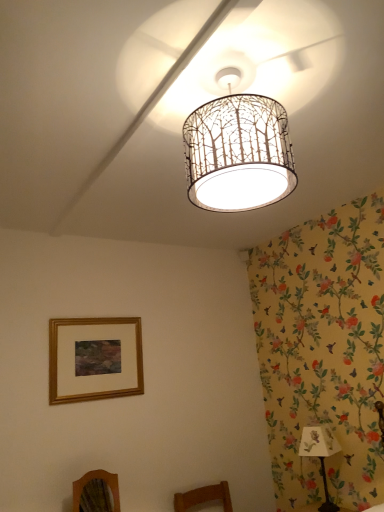
Question: Should I look upward or downward to see wooden mirror at lower left?

Choices:
 (A) up
 (B) down

Answer: (B)

Question: Is the position of gold wooden picture frame at lower left more distant than that of white paper lampshade at center?

Choices:
 (A) yes
 (B) no

Answer: (A)

Question: Can you confirm if gold wooden picture frame at lower left is wider than white paper lampshade at center?

Choices:
 (A) no
 (B) yes

Answer: (A)

Question: Is gold wooden picture frame at lower left to the right of white paper lampshade at center from the viewer's perspective?

Choices:
 (A) yes
 (B) no

Answer: (B)

Question: From a real-world perspective, is gold wooden picture frame at lower left on top of white paper lampshade at center?

Choices:
 (A) yes
 (B) no

Answer: (B)

Question: From a real-world perspective, is gold wooden picture frame at lower left under white paper lampshade at center?

Choices:
 (A) yes
 (B) no

Answer: (A)

Question: Can you confirm if gold wooden picture frame at lower left is bigger than white paper lampshade at center?

Choices:
 (A) yes
 (B) no

Answer: (B)

Question: From a real-world perspective, is white paper shade at lower right located higher than gold wooden picture frame at lower left?

Choices:
 (A) yes
 (B) no

Answer: (B)

Question: Is white paper shade at lower right at the left side of gold wooden picture frame at lower left?

Choices:
 (A) yes
 (B) no

Answer: (B)

Question: Is white paper shade at lower right positioned beyond the bounds of gold wooden picture frame at lower left?

Choices:
 (A) no
 (B) yes

Answer: (B)

Question: Considering the relative sizes of white paper shade at lower right and gold wooden picture frame at lower left in the image provided, is white paper shade at lower right smaller than gold wooden picture frame at lower left?

Choices:
 (A) no
 (B) yes

Answer: (A)

Question: Is white paper shade at lower right taller than gold wooden picture frame at lower left?

Choices:
 (A) no
 (B) yes

Answer: (A)

Question: Is the depth of white paper shade at lower right greater than that of gold wooden picture frame at lower left?

Choices:
 (A) no
 (B) yes

Answer: (A)

Question: Is wooden mirror at lower left to the right of white paper lampshade at center from the viewer's perspective?

Choices:
 (A) yes
 (B) no

Answer: (B)